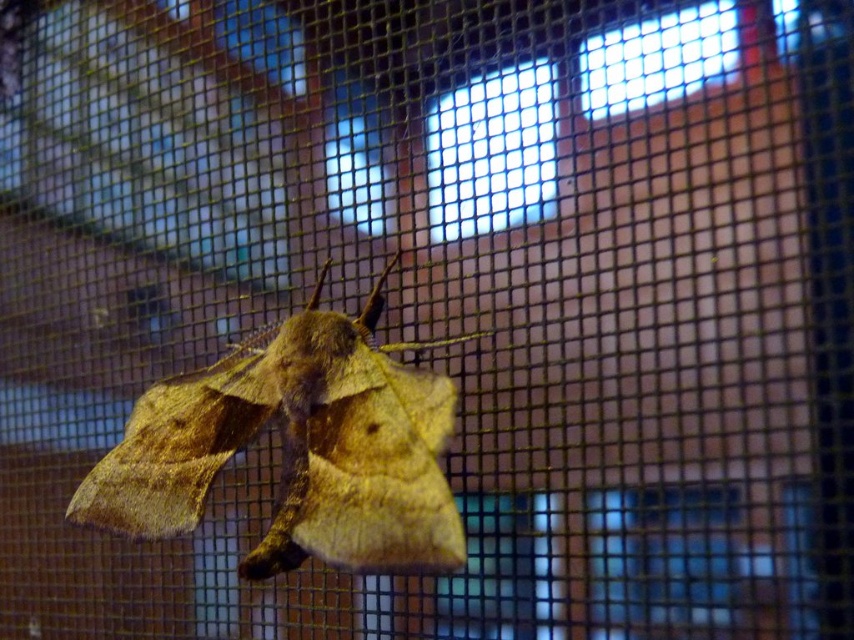
You are a scientist observing a moth through a mesh screen. You notice a specific point at coordinates (297,449). Can you determine which part of the fuzzy brown moth at center this point corresponds to?

The point at (297,449) is on the fuzzy brown moth at center.

You are a window cleaner trying to clean the transparent glass window at upper center. You notice the fuzzy brown moth at center is blocking your view. Which direction should you move the moth to clear your line of sight?

The fuzzy brown moth at center is on the left side of the transparent glass window at upper center, so moving it to the right would clear your line of sight.

You are an exterminator trying to remove the fuzzy brown moth at center from the transparent glass window at upper center. Which object should you target first to ensure the moth is removed effectively?

You should target the fuzzy brown moth at center first because it is larger in size than the transparent glass window at upper center, making it easier to locate and remove.